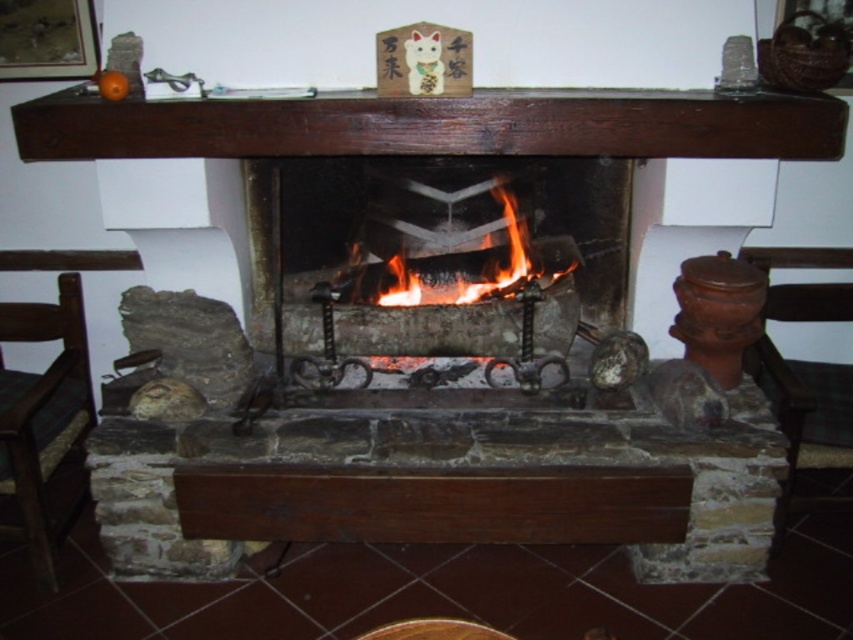
You are a fire safety inspector checking the fireplace setup. You notice the dark brown wood at upper center and the flaming wood at center. According to safety guidelines, flammable materials should not be placed above flames. Is this setup compliant with safety standards?

The dark brown wood at upper center is positioned over the flaming wood at center, which violates safety guidelines as flammable materials should not be placed above flames.

You are standing in front of the fireplace and want to place a 2 feet long decorative item on the dark brown wood at upper center. Is there enough space for it?

The dark brown wood at upper center and viewer are 6.67 feet apart, so the distance between you and the dark brown wood at upper center is 6.67 feet. However, the question is about the space on the dark brown wood itself. The provided information does not specify the dimensions of the dark brown wood at upper center, so it is impossible to determine if the 2 feet long decorative item will fit.

You are a firefighter assessing a house fire. You see the charcoal stone fireplace at center and the flaming wood at center. Which object is located below the other?

The charcoal stone fireplace at center is positioned under the flaming wood at center, so the charcoal stone fireplace is below the flaming wood.